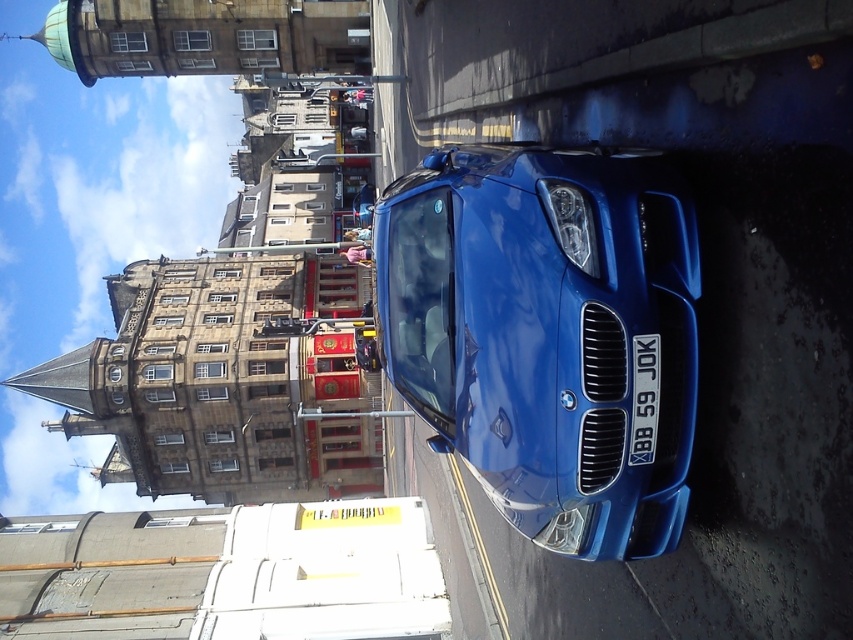
You are a delivery driver who needs to park your vehicle in a spot that can only accommodate cars smaller than the shiny blue car at center. You see the white plastic license plate at center. Can you determine if your vehicle will fit based on the license plate size?

The shiny blue car at center is larger in size than the white plastic license plate at center. However, the size of the license plate does not indicate the size of your vehicle. You cannot determine if your vehicle will fit based solely on the license plate size.

You are a delivery person trying to park your van next to the shiny blue car at center. The parking spot is only wide enough for vehicles up to 2 meters. Can you safely park your van there without hitting the white plastic license plate at center?

The shiny blue car at center might be wider than white plastic license plate at center. Since the parking spot is only 2 meters wide, and the car could be wider than the license plate, it is uncertain if your van will fit without hitting the license plate. Check the car width before parking.

You are a delivery driver who needs to park your vehicle in this area. The parking spot you want to use is located at coordinates point 0.520, 0.640. Is the shiny blue car at center currently occupying that spot?

Yes, the shiny blue car at center is occupying the parking spot at coordinates point (544, 332).